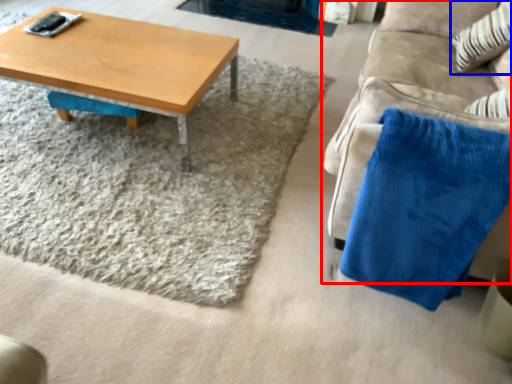
Question: Which object is closer to the camera taking this photo, studio couch (highlighted by a red box) or throw pillow (highlighted by a blue box)?

Choices:
 (A) studio couch
 (B) throw pillow

Answer: (A)